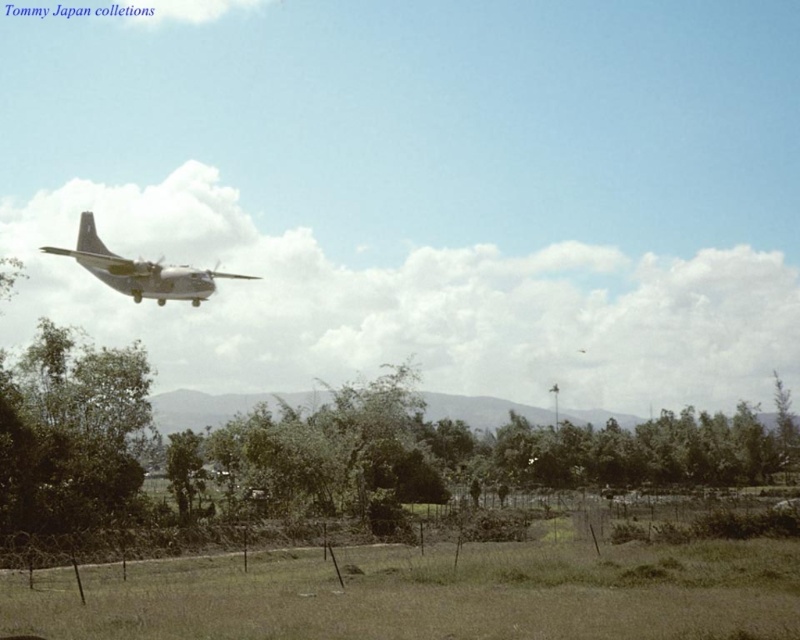
Does green grass at lower center appear under metallic gray airplane at upper left?

Correct, green grass at lower center is located below metallic gray airplane at upper left.

Measure the distance between green grass at lower center and camera.

green grass at lower center and camera are 38.22 feet apart from each other.

The width and height of the screenshot is (800, 640). Describe the element at coordinates (432, 592) in the screenshot. I see `green grass at lower center` at that location.

This screenshot has height=640, width=800. Identify the location of green grass at lower center. (432, 592).